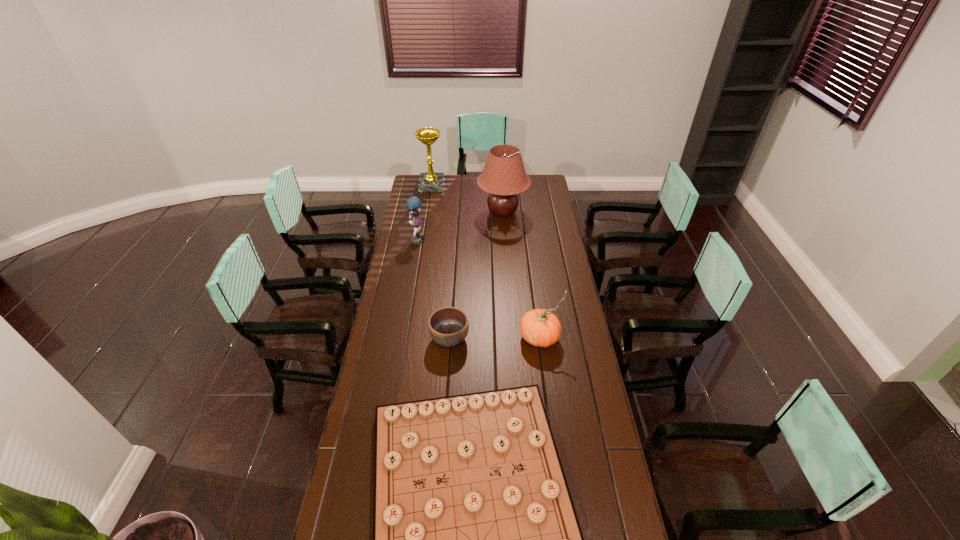
This screenshot has height=540, width=960. Find the location of `object that is at the far edge`. object that is at the far edge is located at coordinates click(x=428, y=182).

Where is `award that is positioned at the left edge`? The height and width of the screenshot is (540, 960). award that is positioned at the left edge is located at coordinates (428, 182).

Locate an element on the screen. rag doll located at the left edge is located at coordinates (413, 203).

You are a GUI agent. You are given a task and a screenshot of the screen. Output one action in this format:
    pyautogui.click(x=<x>, y=<y>)
    Task: Click on the lampshade that is at the right edge
    
    Given the screenshot: What is the action you would take?
    pyautogui.click(x=503, y=176)

At what (x,y) coordinates should I click in order to perform the action: click on pumpkin that is at the right edge. Please return your answer as a coordinate pair (x, y). The image size is (960, 540). Looking at the image, I should click on (539, 327).

Locate an element on the screen. The height and width of the screenshot is (540, 960). object at the far left corner is located at coordinates (428, 182).

I want to click on free space at the far edge, so click(x=490, y=194).

Identify the location of free space at the left edge. The width and height of the screenshot is (960, 540). (390, 382).

At what (x,y) coordinates should I click in order to perform the action: click on vacant space at the right edge of the desktop. Please return your answer as a coordinate pair (x, y). Image resolution: width=960 pixels, height=540 pixels. Looking at the image, I should click on (561, 380).

At what (x,y) coordinates should I click in order to perform the action: click on blank region between the pumpkin and the rag doll. Please return your answer as a coordinate pair (x, y). Looking at the image, I should click on (479, 287).